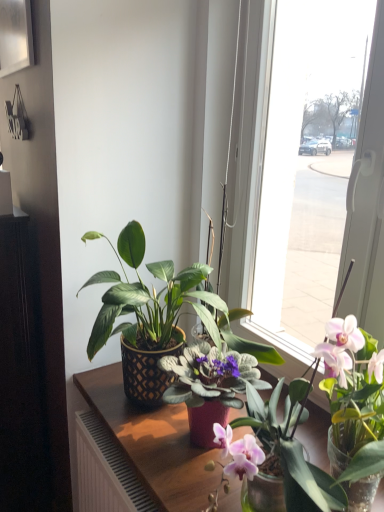
Question: Can you confirm if metallic silver picture frame at upper left is shorter than matte black pot at center?

Choices:
 (A) yes
 (B) no

Answer: (A)

Question: Considering the relative sizes of metallic silver picture frame at upper left and matte black pot at center in the image provided, is metallic silver picture frame at upper left thinner than matte black pot at center?

Choices:
 (A) no
 (B) yes

Answer: (B)

Question: Can you confirm if metallic silver picture frame at upper left is bigger than matte black pot at center?

Choices:
 (A) yes
 (B) no

Answer: (B)

Question: Is metallic silver picture frame at upper left at the left side of matte black pot at center?

Choices:
 (A) yes
 (B) no

Answer: (A)

Question: From the image's perspective, does metallic silver picture frame at upper left appear lower than matte black pot at center?

Choices:
 (A) yes
 (B) no

Answer: (B)

Question: Based on their sizes in the image, would you say wooden table at center is bigger or smaller than matte black pot at center?

Choices:
 (A) big
 (B) small

Answer: (A)

Question: Considering the relative positions of wooden table at center and matte black pot at center in the image provided, is wooden table at center to the left or to the right of matte black pot at center?

Choices:
 (A) left
 (B) right

Answer: (A)

Question: From the image's perspective, relative to matte black pot at center, is wooden table at center above or below?

Choices:
 (A) below
 (B) above

Answer: (A)

Question: Considering the positions of wooden table at center and matte black pot at center in the image, is wooden table at center taller or shorter than matte black pot at center?

Choices:
 (A) short
 (B) tall

Answer: (B)

Question: From a real-world perspective, relative to wooden table at center, is matte black pot at center vertically above or below?

Choices:
 (A) below
 (B) above

Answer: (B)

Question: Is matte black pot at center inside or outside of wooden table at center?

Choices:
 (A) outside
 (B) inside

Answer: (A)

Question: Is matte black pot at center wider or thinner than wooden table at center?

Choices:
 (A) thin
 (B) wide

Answer: (A)

Question: Is matte black pot at center to the left or to the right of wooden table at center in the image?

Choices:
 (A) left
 (B) right

Answer: (B)

Question: Would you say wooden table at center is to the left or to the right of metallic silver picture frame at upper left in the picture?

Choices:
 (A) left
 (B) right

Answer: (B)

Question: Based on their sizes in the image, would you say wooden table at center is bigger or smaller than metallic silver picture frame at upper left?

Choices:
 (A) big
 (B) small

Answer: (A)